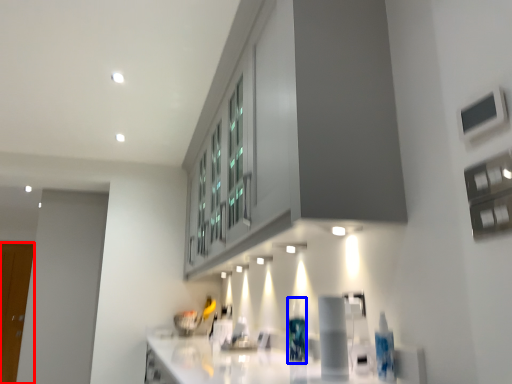
Question: Which object is further to the camera taking this photo, glass door (highlighted by a red box) or bottle (highlighted by a blue box)?

Choices:
 (A) glass door
 (B) bottle

Answer: (A)